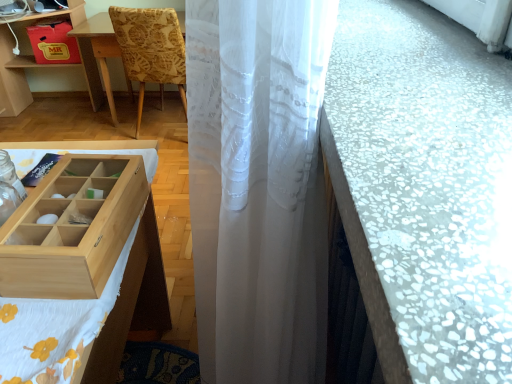
Question: Is white mosaic tile counter top at right positioned with its back to white sheer curtain at center?

Choices:
 (A) yes
 (B) no

Answer: (B)

Question: Is the depth of white mosaic tile counter top at right less than that of white sheer curtain at center?

Choices:
 (A) yes
 (B) no

Answer: (A)

Question: Could you tell me if white mosaic tile counter top at right is turned towards white sheer curtain at center?

Choices:
 (A) no
 (B) yes

Answer: (B)

Question: Is white mosaic tile counter top at right located outside white sheer curtain at center?

Choices:
 (A) yes
 (B) no

Answer: (A)

Question: Considering the relative positions of white mosaic tile counter top at right and white sheer curtain at center in the image provided, is white mosaic tile counter top at right to the right of white sheer curtain at center from the viewer's perspective?

Choices:
 (A) yes
 (B) no

Answer: (A)

Question: Based on their sizes in the image, would you say wooden table at left is bigger or smaller than white fabric at left?

Choices:
 (A) small
 (B) big

Answer: (B)

Question: Considering the positions of wooden table at left and white fabric at left in the image, is wooden table at left wider or thinner than white fabric at left?

Choices:
 (A) wide
 (B) thin

Answer: (A)

Question: From a real-world perspective, is wooden table at left physically located above or below white fabric at left?

Choices:
 (A) below
 (B) above

Answer: (B)

Question: Is wooden table at left in front of or behind white fabric at left in the image?

Choices:
 (A) behind
 (B) front

Answer: (A)

Question: Is wooden table at left in front of or behind white mosaic tile counter top at right in the image?

Choices:
 (A) front
 (B) behind

Answer: (B)

Question: Is wooden table at left taller or shorter than white mosaic tile counter top at right?

Choices:
 (A) short
 (B) tall

Answer: (B)

Question: From a real-world perspective, is wooden table at left above or below white mosaic tile counter top at right?

Choices:
 (A) above
 (B) below

Answer: (B)

Question: Choose the correct answer: Is wooden table at left inside white mosaic tile counter top at right or outside it?

Choices:
 (A) inside
 (B) outside

Answer: (B)

Question: Is white mosaic tile counter top at right inside or outside of wooden table at left?

Choices:
 (A) inside
 (B) outside

Answer: (B)

Question: In terms of height, does white mosaic tile counter top at right look taller or shorter compared to wooden table at left?

Choices:
 (A) tall
 (B) short

Answer: (B)